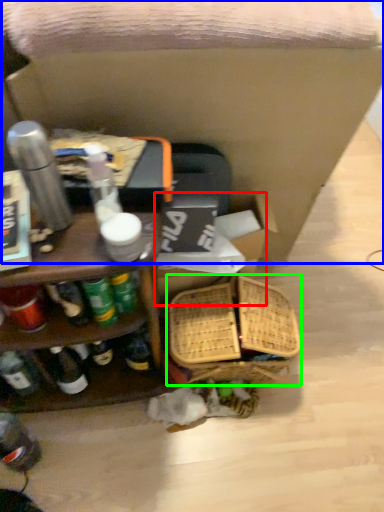
Question: Considering the real-world distances, which object is closest to storage box (highlighted by a red box)? swivel chair (highlighted by a blue box) or basket (highlighted by a green box).

Choices:
 (A) swivel chair
 (B) basket

Answer: (B)